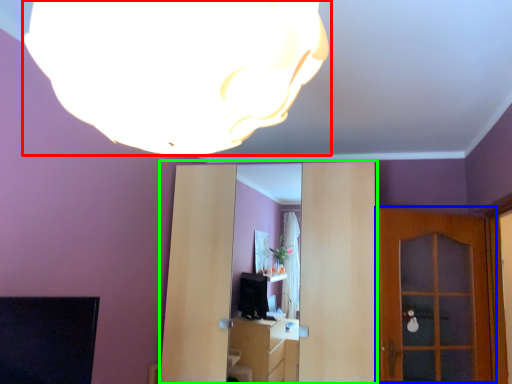
Question: Based on their relative distances, which object is farther from lamp (highlighted by a red box)? Choose from door (highlighted by a blue box) and entertainment center (highlighted by a green box).

Choices:
 (A) door
 (B) entertainment center

Answer: (A)